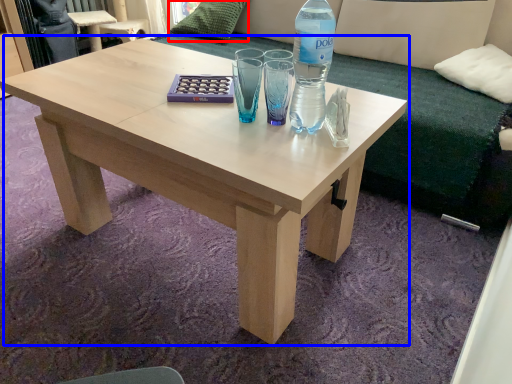
Question: Which of the following is the closest to the observer, pillow (highlighted by a red box) or coffee table (highlighted by a blue box)?

Choices:
 (A) pillow
 (B) coffee table

Answer: (B)